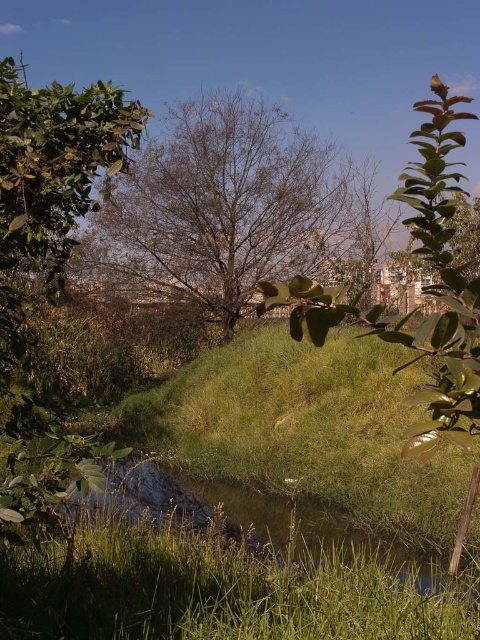
Is bare branches tree at center thinner than green leafy tree at left?

Indeed, bare branches tree at center has a lesser width compared to green leafy tree at left.

Who is taller, bare branches tree at center or green leafy tree at left?

green leafy tree at left

Describe the element at coordinates (227, 208) in the screenshot. I see `bare branches tree at center` at that location.

The height and width of the screenshot is (640, 480). I want to click on bare branches tree at center, so click(x=227, y=208).

Describe the element at coordinates (227, 208) in the screenshot. I see `bare branches tree at center` at that location.

Who is higher up, bare branches tree at center or green leafy tree at center?

bare branches tree at center is above.

Between point (314, 161) and point (474, 346), which one is positioned behind?

The point (314, 161) is behind.

Identify the location of bare branches tree at center. The height and width of the screenshot is (640, 480). (227, 208).

Does green leafy tree at left appear under green leafy tree at center?

No.

Does green leafy tree at left have a smaller size compared to green leafy tree at center?

Incorrect, green leafy tree at left is not smaller in size than green leafy tree at center.

Who is more distant from viewer, (26, 131) or (465, 358)?

Positioned behind is point (26, 131).

Where is `green leafy tree at left`? green leafy tree at left is located at coordinates (47, 275).